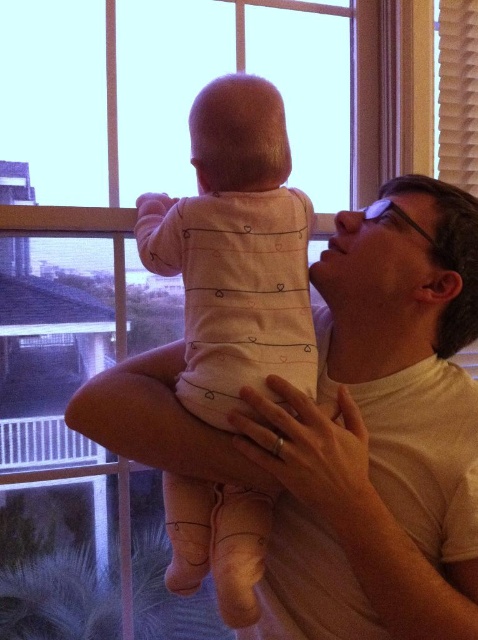
You are a photographer setting up for a family portrait. You need to ensure that the white matte shirt at upper center and the pink fabric baby at center are both visible in the frame. Based on their positions, which object should you focus on first to ensure both are in focus?

The white matte shirt at upper center is wider than the pink fabric baby at center, so focusing on the wider object first will help ensure both are in focus.

You are a photographer trying to capture the scene where the white matte arm at center and the pink fabric baby at center are positioned. Based on their sizes, which object would appear closer to the camera in the photo?

The white matte arm at center has a smaller size compared to the pink fabric baby at center. In photography, objects that are smaller in the frame can sometimes appear farther away if they are actually closer but depicted smaller, but according to the description, the white matte arm is smaller in size. However, without depth cues, it is challenging to determine solely based on size. The answer might need more context about their actual positions. However, following the rule to use the description, the size

You are standing in front of the scene and want to reach the point marked as point (x=460, y=461). If your arm can extend 30 inches, can you touch it without moving your feet?

The point (x=460, y=461) is 32.90 inches away from the viewer. Since your arm can only extend 30 inches, you cannot reach it without moving your feet.